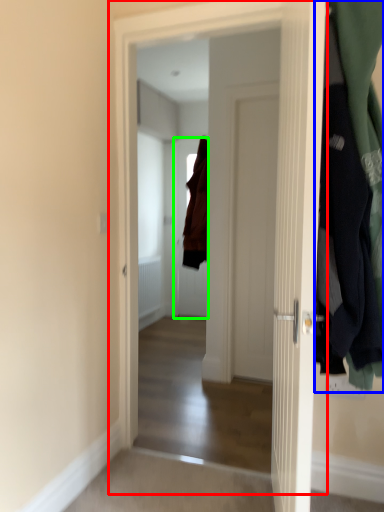
Question: Based on their relative distances, which object is farther from door (highlighted by a red box)? Choose from closet (highlighted by a blue box) and door (highlighted by a green box).

Choices:
 (A) closet
 (B) door

Answer: (B)